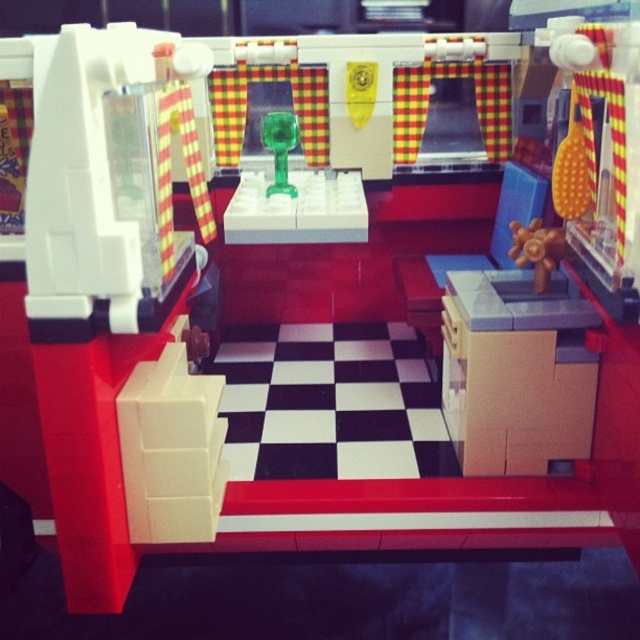
Question: Considering the relative positions of wooden fan at center right and green translucent plastic cup at center in the image provided, where is wooden fan at center right located with respect to green translucent plastic cup at center?

Choices:
 (A) above
 (B) below

Answer: (B)

Question: Can you confirm if wooden fan at center right is positioned above green translucent plastic cup at center?

Choices:
 (A) yes
 (B) no

Answer: (B)

Question: Which point is closer to the camera?

Choices:
 (A) wooden fan at center right
 (B) green translucent plastic cup at center

Answer: (A)

Question: Is wooden fan at center right thinner than green translucent plastic cup at center?

Choices:
 (A) yes
 (B) no

Answer: (A)

Question: Which point is closer to the camera taking this photo?

Choices:
 (A) pyautogui.click(x=291, y=148)
 (B) pyautogui.click(x=516, y=228)

Answer: (B)